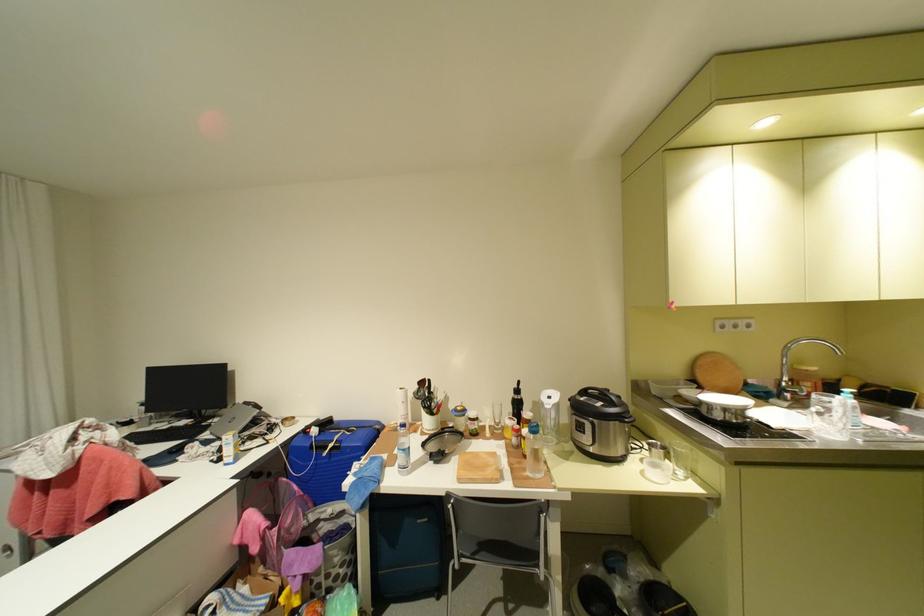
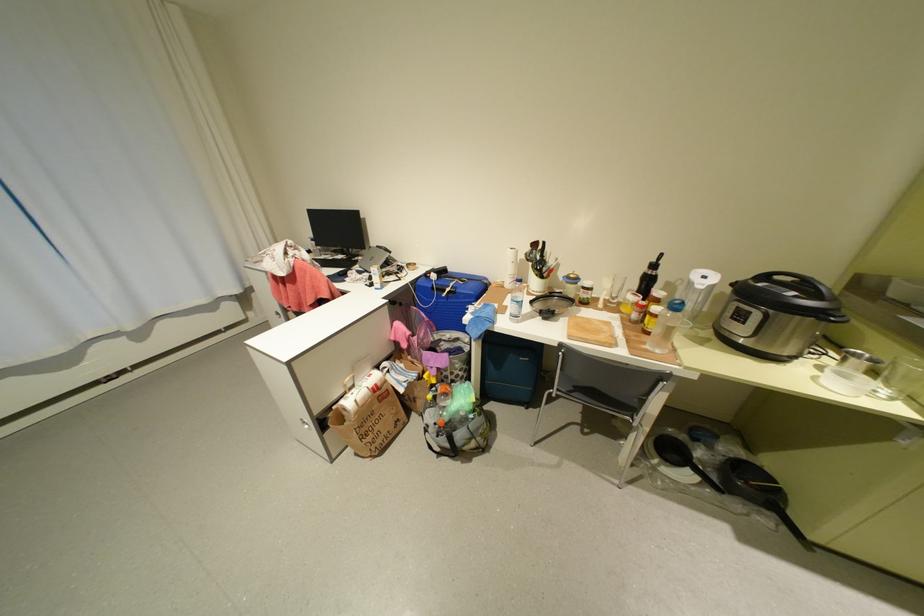
The point at (537, 474) is marked in the first image. Where is the corresponding point in the second image?

(655, 347)